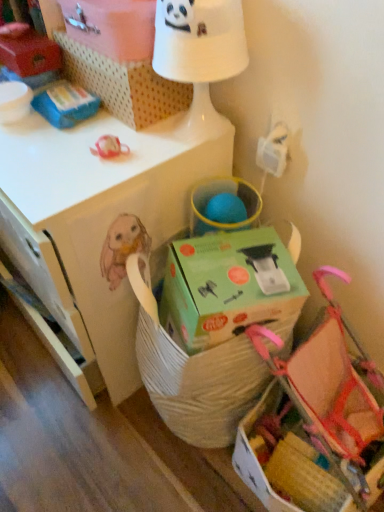
The image size is (384, 512). Describe the element at coordinates (30, 54) in the screenshot. I see `matte plastic storage box at upper left, which appears as the 2th storage box when viewed from the right` at that location.

This screenshot has height=512, width=384. What do you see at coordinates (199, 41) in the screenshot? I see `white glossy table lamp at upper center` at bounding box center [199, 41].

Measure the distance between white matte desk at center and camera.

white matte desk at center is 76.10 centimeters from camera.

What do you see at coordinates (315, 423) in the screenshot? I see `pink fabric baby carriage at lower right` at bounding box center [315, 423].

What do you see at coordinates (123, 84) in the screenshot? I see `white cardboard box at upper center, which is the first storage box in right-to-left order` at bounding box center [123, 84].

You are a GUI agent. You are given a task and a screenshot of the screen. Output one action in this format:
    pyautogui.click(x=<x>, y=<y>)
    Task: Click on the green cardboard box at center, the 2th cardboard box viewed from the top
    
    Given the screenshot: What is the action you would take?
    pyautogui.click(x=227, y=286)

Is matte plastic storage box at upper left, the first storage box in the left-to-right sequence, outside of white glossy table lamp at upper center?

Yes, matte plastic storage box at upper left, the first storage box in the left-to-right sequence, is located beyond the bounds of white glossy table lamp at upper center.

From a real-world perspective, is matte plastic storage box at upper left, the first storage box in the left-to-right sequence, on white glossy table lamp at upper center?

No.

Is point (1, 42) farther from viewer compared to point (227, 36)?

Yes, it is behind point (227, 36).

Can you confirm if white matte desk at center is smaller than green cardboard box at center, the 2th cardboard box viewed from the top?

Incorrect, white matte desk at center is not smaller in size than green cardboard box at center, the 2th cardboard box viewed from the top.

Between white matte desk at center and green cardboard box at center, which ranks as the first cardboard box in bottom-to-top order, which one has less height?

Standing shorter between the two is green cardboard box at center, which ranks as the first cardboard box in bottom-to-top order.

At what (x,y) coordinates should I click in order to perform the action: click on cardboard box below the white matte desk at center (from the image's perspective). Please return your answer as a coordinate pair (x, y). This screenshot has height=512, width=384. Looking at the image, I should click on (227, 286).

Which is farther from the camera, [38,155] or [256,229]?

Positioned behind is point [256,229].

Could you tell me if white cardboard box at upper center, which is the second cardboard box from bottom to top, is facing pink fabric baby carriage at lower right?

No.

Does white cardboard box at upper center, which is the second cardboard box from bottom to top, come behind pink fabric baby carriage at lower right?

Yes, white cardboard box at upper center, which is the second cardboard box from bottom to top, is further from the camera.

From the image's perspective, is white cardboard box at upper center, the 1th cardboard box when ordered from top to bottom, above or below pink fabric baby carriage at lower right?

Clearly, from the image's perspective, white cardboard box at upper center, the 1th cardboard box when ordered from top to bottom, is above pink fabric baby carriage at lower right.

Identify the location of the 2nd cardboard box positioned above the pink fabric baby carriage at lower right (from a real-world perspective). (112, 27).

Is matte plastic storage box at upper left, the first storage box in the left-to-right sequence, completely or partially inside white matte desk at center?

No, white matte desk at center does not contain matte plastic storage box at upper left, the first storage box in the left-to-right sequence.

What's the angular difference between white matte desk at center and matte plastic storage box at upper left, which appears as the 2th storage box when viewed from the right,'s facing directions?

2.55 degrees.

From a real-world perspective, between white matte desk at center and matte plastic storage box at upper left, the first storage box in the left-to-right sequence, who is vertically lower?

white matte desk at center is physically lower.

Can you confirm if white matte desk at center is positioned to the left of matte plastic storage box at upper left, the first storage box in the left-to-right sequence?

No.

Choose the correct answer: Is white cardboard box at upper center, which is the first storage box in right-to-left order, inside pink fabric baby carriage at lower right or outside it?

white cardboard box at upper center, which is the first storage box in right-to-left order, is spatially situated outside pink fabric baby carriage at lower right.

From the image's perspective, is white cardboard box at upper center, the second storage box in the left-to-right sequence, over pink fabric baby carriage at lower right?

Yes, from the image's perspective, white cardboard box at upper center, the second storage box in the left-to-right sequence, is over pink fabric baby carriage at lower right.

From a real-world perspective, is white cardboard box at upper center, the second storage box in the left-to-right sequence, beneath pink fabric baby carriage at lower right?

Incorrect, from a real-world perspective, white cardboard box at upper center, the second storage box in the left-to-right sequence, is higher than pink fabric baby carriage at lower right.

From a real-world perspective, which object stands above the other?

In real-world perspective, matte plastic storage box at upper left, which appears as the 2th storage box when viewed from the right, is above.

Could you tell me if matte plastic storage box at upper left, the first storage box in the left-to-right sequence, is facing green cardboard box at center, which ranks as the first cardboard box in bottom-to-top order?

No.

Which is closer to the camera, [20,75] or [188,352]?

Point [20,75] appears to be farther away from the viewer than point [188,352].

How far apart are matte plastic storage box at upper left, the first storage box in the left-to-right sequence, and green cardboard box at center, which ranks as the first cardboard box in bottom-to-top order?

matte plastic storage box at upper left, the first storage box in the left-to-right sequence, and green cardboard box at center, which ranks as the first cardboard box in bottom-to-top order, are 66.57 centimeters apart from each other.

From the image's perspective, does white glossy table lamp at upper center appear higher than white cardboard box at upper center, the 1th cardboard box when ordered from top to bottom?

Incorrect, from the image's perspective, white glossy table lamp at upper center is lower than white cardboard box at upper center, the 1th cardboard box when ordered from top to bottom.

Which object is closer to the camera, white glossy table lamp at upper center or white cardboard box at upper center, the 1th cardboard box when ordered from top to bottom?

white glossy table lamp at upper center is in front.

From the picture: How many degrees apart are the facing directions of white glossy table lamp at upper center and white cardboard box at upper center, the 1th cardboard box when ordered from top to bottom?

There is a 0.000619-degree angle between the facing directions of white glossy table lamp at upper center and white cardboard box at upper center, the 1th cardboard box when ordered from top to bottom.

Would you consider white glossy table lamp at upper center to be distant from white cardboard box at upper center, which is the second cardboard box from bottom to top?

No, white glossy table lamp at upper center is not far from white cardboard box at upper center, which is the second cardboard box from bottom to top.

This screenshot has width=384, height=512. I want to click on storage box that is the 2nd object located above the white glossy table lamp at upper center (from the image's perspective), so click(30, 54).

Locate an element on the screen. The height and width of the screenshot is (512, 384). cardboard box lying in front of the white matte desk at center is located at coordinates 227,286.

From the image, which object appears to be nearer to matte plastic storage box at upper left, the first storage box in the left-to-right sequence, pink fabric baby carriage at lower right or white cardboard box at upper center, the second storage box in the left-to-right sequence?

white cardboard box at upper center, the second storage box in the left-to-right sequence, is closer to matte plastic storage box at upper left, the first storage box in the left-to-right sequence.

Which object lies further to the anchor point white cardboard box at upper center, the second storage box in the left-to-right sequence, white matte desk at center or white cardboard box at upper center, the 1th cardboard box when ordered from top to bottom?

white matte desk at center is positioned further to the anchor white cardboard box at upper center, the second storage box in the left-to-right sequence.

Based on their spatial positions, is white cardboard box at upper center, which is the second cardboard box from bottom to top, or pink fabric baby carriage at lower right closer to matte plastic storage box at upper left, the first storage box in the left-to-right sequence?

white cardboard box at upper center, which is the second cardboard box from bottom to top, is closer to matte plastic storage box at upper left, the first storage box in the left-to-right sequence.

Looking at the image, which one is located closer to pink fabric baby carriage at lower right, green cardboard box at center, the 2th cardboard box viewed from the top, or matte plastic storage box at upper left, which appears as the 2th storage box when viewed from the right?

The object closer to pink fabric baby carriage at lower right is green cardboard box at center, the 2th cardboard box viewed from the top.

Based on their spatial positions, is white matte desk at center or white glossy table lamp at upper center further from pink fabric baby carriage at lower right?

white glossy table lamp at upper center lies further to pink fabric baby carriage at lower right than the other object.

In the scene shown: When comparing their distances from pink fabric baby carriage at lower right, does white cardboard box at upper center, the 1th cardboard box when ordered from top to bottom, or white matte desk at center seem closer?

The object closer to pink fabric baby carriage at lower right is white matte desk at center.

Considering their positions, is white cardboard box at upper center, the second storage box in the left-to-right sequence, positioned closer to pink fabric baby carriage at lower right than matte plastic storage box at upper left, which appears as the 2th storage box when viewed from the right?

The object closer to pink fabric baby carriage at lower right is white cardboard box at upper center, the second storage box in the left-to-right sequence.

Looking at the image, which one is located closer to white matte desk at center, green cardboard box at center, the 2th cardboard box viewed from the top, or white cardboard box at upper center, which is the first storage box in right-to-left order?

white cardboard box at upper center, which is the first storage box in right-to-left order, is positioned closer to the anchor white matte desk at center.

Where is `table lamp between matte plastic storage box at upper left, the first storage box in the left-to-right sequence, and green cardboard box at center, which ranks as the first cardboard box in bottom-to-top order, vertically`? This screenshot has height=512, width=384. table lamp between matte plastic storage box at upper left, the first storage box in the left-to-right sequence, and green cardboard box at center, which ranks as the first cardboard box in bottom-to-top order, vertically is located at coordinates (199, 41).

Where is `table lamp between white cardboard box at upper center, which is the second cardboard box from bottom to top, and pink fabric baby carriage at lower right in the up-down direction`? The image size is (384, 512). table lamp between white cardboard box at upper center, which is the second cardboard box from bottom to top, and pink fabric baby carriage at lower right in the up-down direction is located at coordinates (199, 41).

Identify the location of storage box between white matte desk at center and white glossy table lamp at upper center in the horizontal direction. This screenshot has width=384, height=512. (123, 84).

The image size is (384, 512). In order to click on desk between matte plastic storage box at upper left, the first storage box in the left-to-right sequence, and green cardboard box at center, which ranks as the first cardboard box in bottom-to-top order, vertically in this screenshot , I will do `click(99, 216)`.